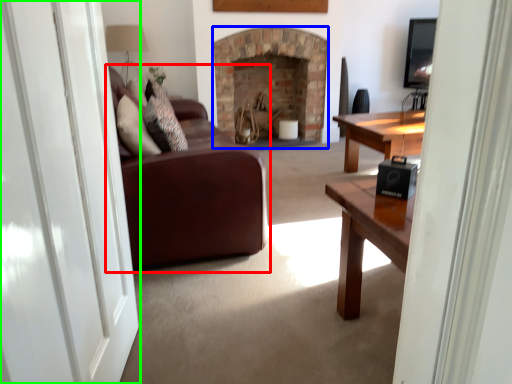
Question: Considering the real-world distances, which object is closest to studio couch (highlighted by a red box)? fireplace (highlighted by a blue box) or screen door (highlighted by a green box).

Choices:
 (A) fireplace
 (B) screen door

Answer: (B)